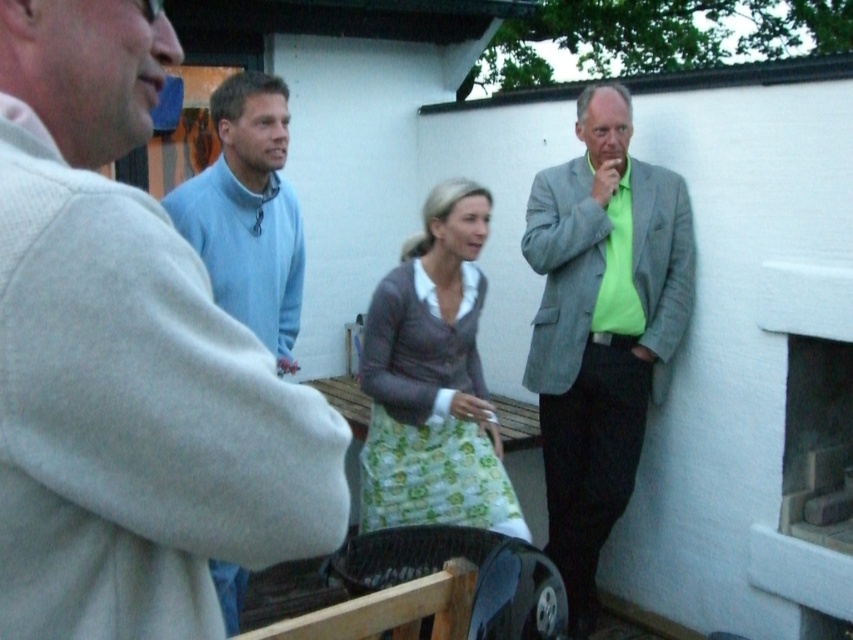
Question: Which point appears farthest from the camera in this image?

Choices:
 (A) click(498, 493)
 (B) click(602, 380)
 (C) click(799, 435)
 (D) click(238, 157)

Answer: (B)

Question: Does gray textured blazer at right appear on the left side of green floral apron at center?

Choices:
 (A) no
 (B) yes

Answer: (A)

Question: Which point appears farthest from the camera in this image?

Choices:
 (A) (830, 579)
 (B) (218, 193)
 (C) (393, 515)

Answer: (C)

Question: Does light gray sweater at upper left have a greater width compared to gray textured blazer at right?

Choices:
 (A) no
 (B) yes

Answer: (A)

Question: Which point appears closest to the camera in this image?

Choices:
 (A) (119, 461)
 (B) (689, 273)
 (C) (845, 294)

Answer: (A)

Question: Is light gray sweater at upper left below green floral apron at center?

Choices:
 (A) yes
 (B) no

Answer: (B)